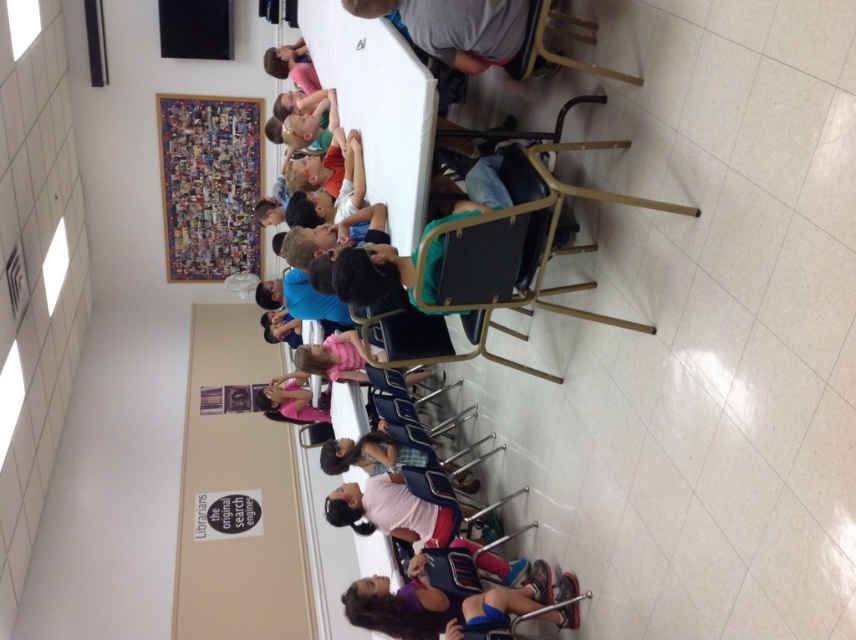
Can you confirm if matte purple shirt at lower center is bigger than pink fabric dress at center?

Correct, matte purple shirt at lower center is larger in size than pink fabric dress at center.

Who is more forward, (574,600) or (305,390)?

Positioned in front is point (574,600).

Between point (560, 602) and point (266, 390), which one is positioned behind?

Positioned behind is point (266, 390).

Locate an element on the screen. matte purple shirt at lower center is located at coordinates (455, 604).